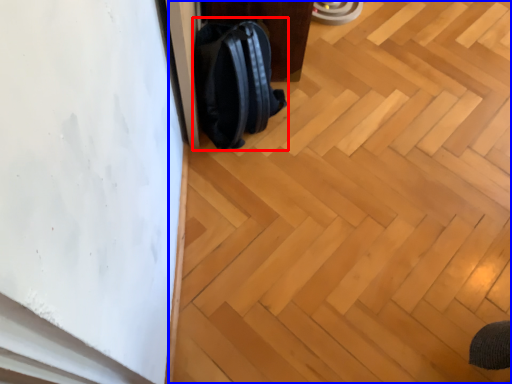
Question: Which point is closer to the camera, backpack (highlighted by a red box) or plywood (highlighted by a blue box)?

Choices:
 (A) backpack
 (B) plywood

Answer: (B)